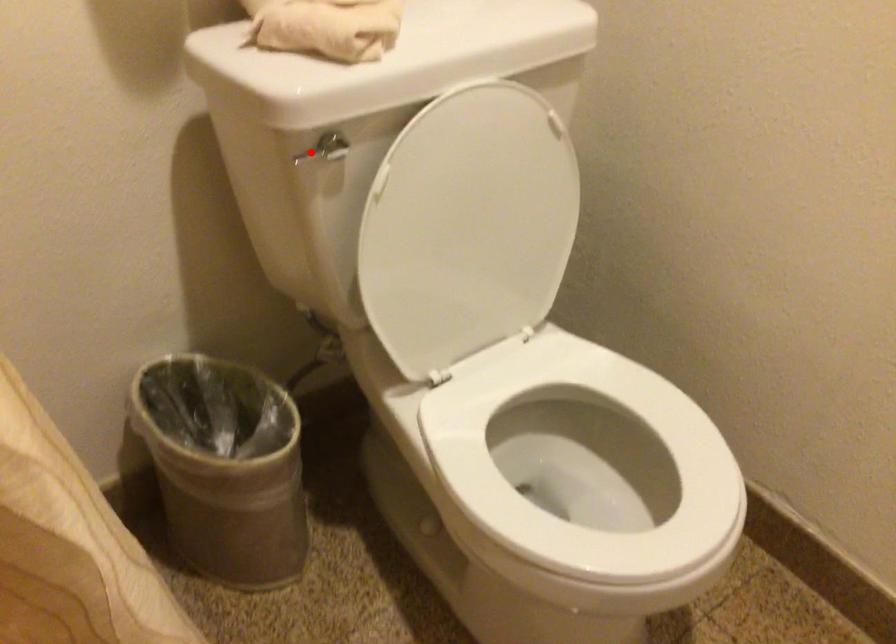
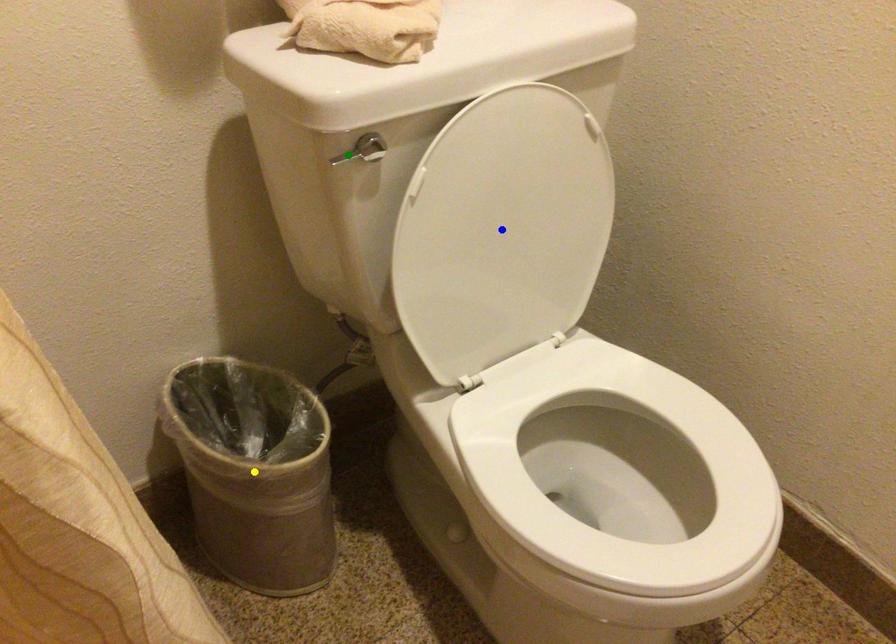
Question: I am providing you with two images of the same scene from different viewpoints. A red point is marked on the first image. You are given multiple points on the second image. Which mark in image 2 goes with the point in image 1?

Choices:
 (A) yellow point
 (B) green point
 (C) blue point

Answer: (B)